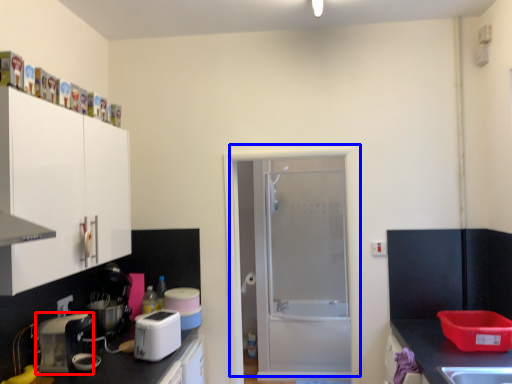
Question: Which object appears farthest to the camera in this image, kitchen appliance (highlighted by a red box) or door (highlighted by a blue box)?

Choices:
 (A) kitchen appliance
 (B) door

Answer: (B)